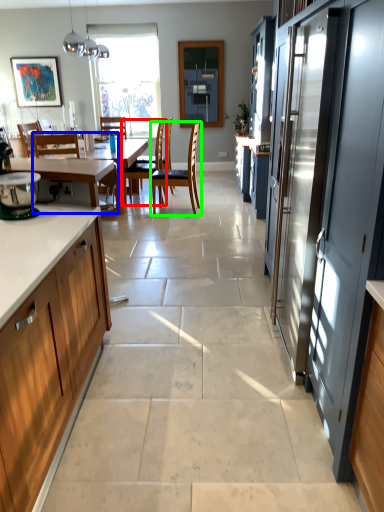
Question: Considering the real-world distances, which object is farthest from chair (highlighted by a red box)? chair (highlighted by a blue box) or chair (highlighted by a green box)?

Choices:
 (A) chair
 (B) chair

Answer: (A)